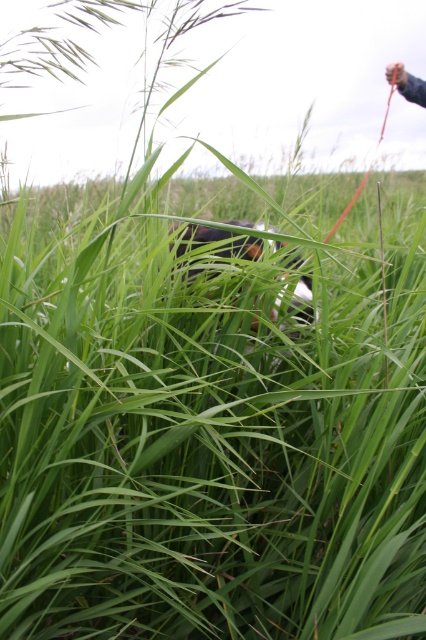
You are standing in the tall grassland scene. There are two points marked in the image. Which point, point (423, 474) or point (420, 104), is closer to you?

Point (423, 474) is closer to you than point (420, 104).

You are a hiker trying to spot the black fur dog at center in the green grassy field at center. Considering the sizes of both, which one is easier to see from a distance?

The green grassy field at center is bigger than the black fur dog at center, so the green grassy field at center is easier to see from a distance.